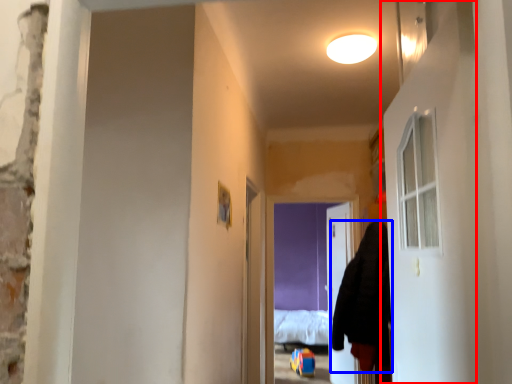
Question: Which object is closer to the camera taking this photo, door (highlighted by a red box) or hoodie (highlighted by a blue box)?

Choices:
 (A) door
 (B) hoodie

Answer: (A)